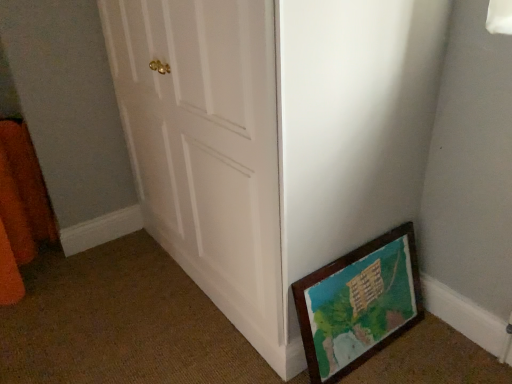
Question: Considering the positions of orange fuzzy curtain at left and wooden picture frame at lower right in the image, is orange fuzzy curtain at left taller or shorter than wooden picture frame at lower right?

Choices:
 (A) tall
 (B) short

Answer: (A)

Question: Is orange fuzzy curtain at left in front of or behind wooden picture frame at lower right in the image?

Choices:
 (A) behind
 (B) front

Answer: (A)

Question: Which object is the farthest from the wooden picture frame at lower right?

Choices:
 (A) white wooden door at center
 (B) orange fuzzy curtain at left

Answer: (B)

Question: Which of these objects is positioned farthest from the white wooden door at center?

Choices:
 (A) wooden picture frame at lower right
 (B) orange fuzzy curtain at left

Answer: (B)